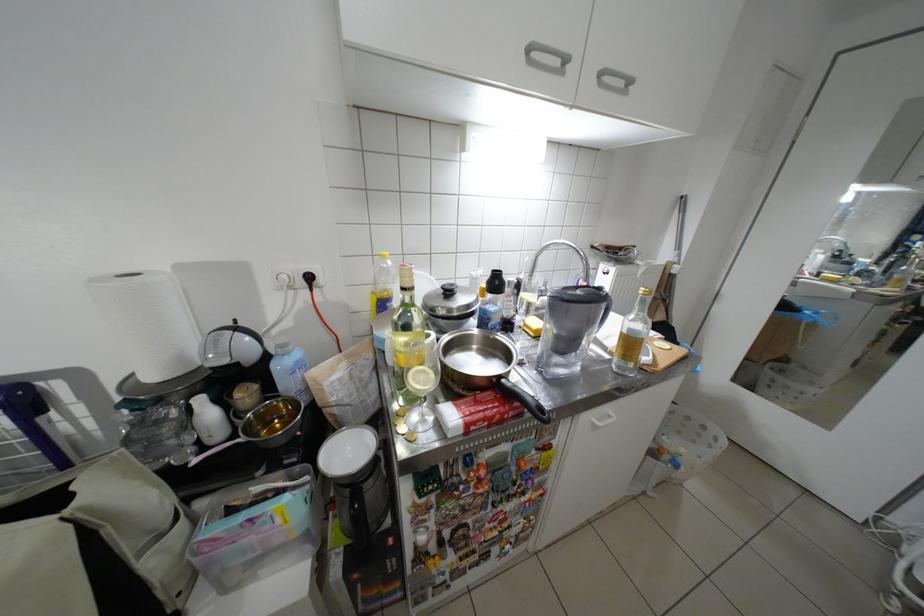
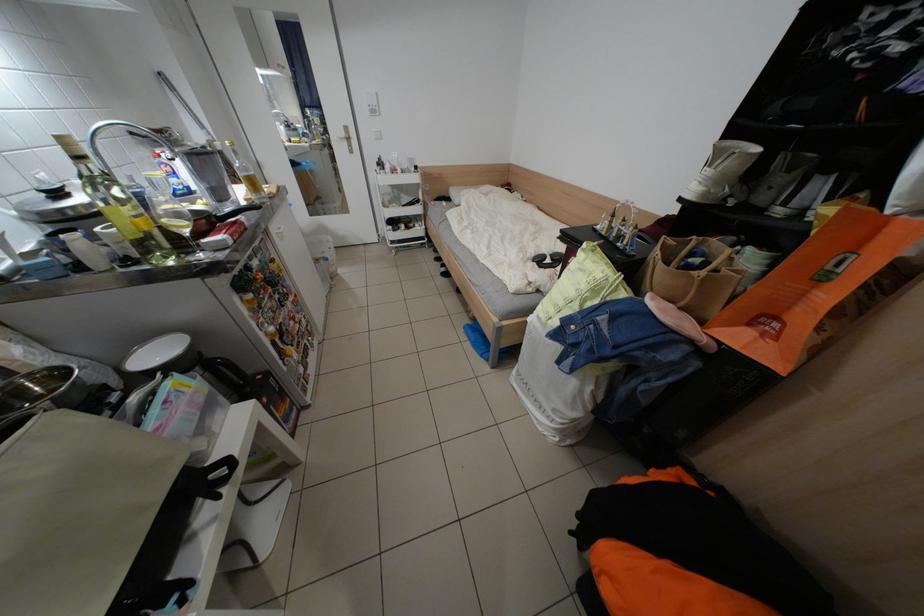
In the second image, find the point that corresponds to the point at 687,270 in the first image.

(231, 148)